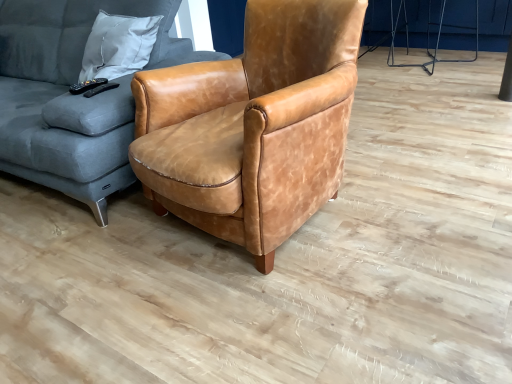
Question: Considering the relative positions of matte brown leather armchair at center and velvet grey couch at left in the image provided, is matte brown leather armchair at center to the left or to the right of velvet grey couch at left?

Choices:
 (A) right
 (B) left

Answer: (A)

Question: Is matte brown leather armchair at center taller or shorter than velvet grey couch at left?

Choices:
 (A) short
 (B) tall

Answer: (A)

Question: Which is nearer to the velvet grey couch at left?

Choices:
 (A) matte brown leather armchair at center
 (B) metallic silver tripod at upper right

Answer: (A)

Question: Estimate the real-world distances between objects in this image. Which object is farther from the matte brown leather armchair at center?

Choices:
 (A) metallic silver tripod at upper right
 (B) velvet grey couch at left

Answer: (A)